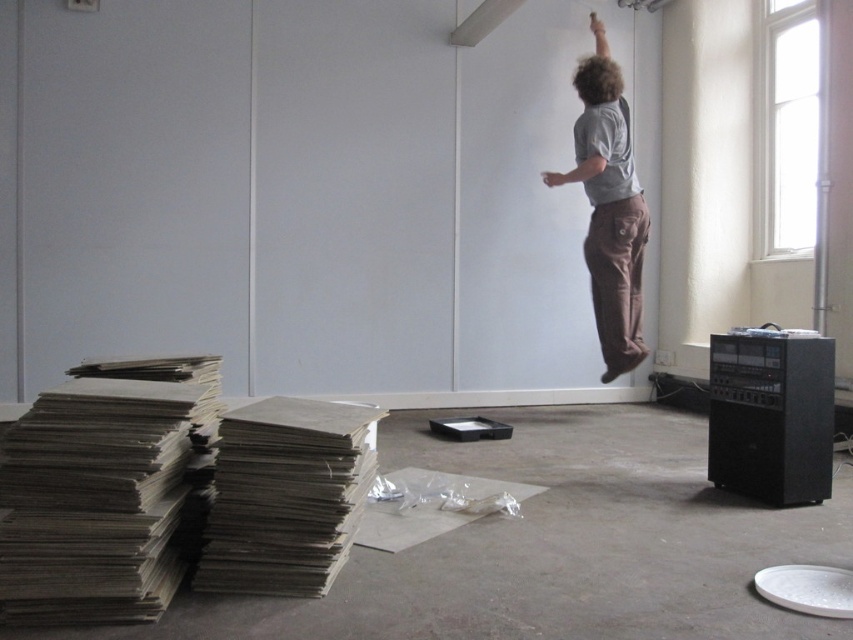
Question: Considering the relative positions of gray cardboard stack at lower left and brown cotton pants at upper right in the image provided, where is gray cardboard stack at lower left located with respect to brown cotton pants at upper right?

Choices:
 (A) below
 (B) above

Answer: (A)

Question: Does gray cardboard stack at lower left have a lesser width compared to brown cotton pants at upper right?

Choices:
 (A) yes
 (B) no

Answer: (A)

Question: Among these points, which one is farthest from the camera?

Choices:
 (A) (633, 195)
 (B) (84, 392)

Answer: (A)

Question: Where is gray cardboard stack at lower left located in relation to brown cotton pants at upper right in the image?

Choices:
 (A) below
 (B) above

Answer: (A)